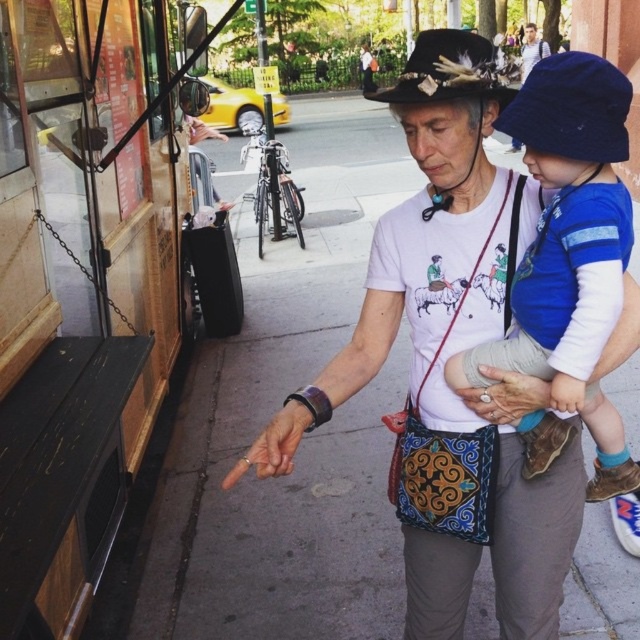
From the picture: Does white cotton t-shirt at center appear on the right side of black felt cowboy hat at upper center?

In fact, white cotton t-shirt at center is to the left of black felt cowboy hat at upper center.

Which is below, white cotton t-shirt at center or black felt cowboy hat at upper center?

white cotton t-shirt at center

Between point (515, 193) and point (448, 38), which one is positioned in front?

Positioned in front is point (448, 38).

I want to click on white cotton t-shirt at center, so click(x=451, y=328).

Between blue cotton hat at upper right and black felt cowboy hat at upper center, which one has more height?

black felt cowboy hat at upper center

The height and width of the screenshot is (640, 640). What do you see at coordinates (570, 250) in the screenshot?
I see `blue cotton hat at upper right` at bounding box center [570, 250].

Between point (609, 428) and point (419, 54), which one is positioned behind?

The point (609, 428) is more distant.

Identify the location of blue cotton hat at upper right. (570, 250).

Is white cotton t-shirt at center to the right of blue cotton hat at upper right from the viewer's perspective?

No, white cotton t-shirt at center is not to the right of blue cotton hat at upper right.

Between white cotton t-shirt at center and blue cotton hat at upper right, which one appears on the right side from the viewer's perspective?

From the viewer's perspective, blue cotton hat at upper right appears more on the right side.

You are a GUI agent. You are given a task and a screenshot of the screen. Output one action in this format:
    pyautogui.click(x=<x>, y=<y>)
    Task: Click on the white cotton t-shirt at center
    The width and height of the screenshot is (640, 640).
    Given the screenshot: What is the action you would take?
    pyautogui.click(x=451, y=328)